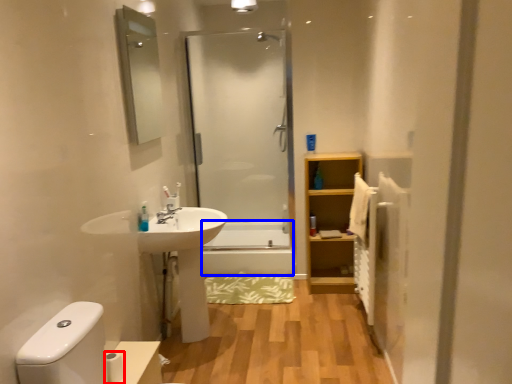
Question: Which point is further to the camera, toilet paper (highlighted by a red box) or bath (highlighted by a blue box)?

Choices:
 (A) toilet paper
 (B) bath

Answer: (B)